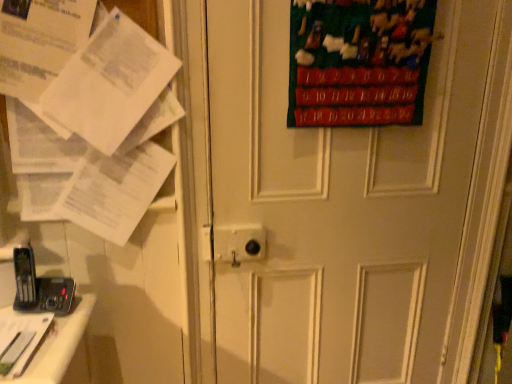
The height and width of the screenshot is (384, 512). What do you see at coordinates (40, 287) in the screenshot?
I see `black plastic phone at lower left` at bounding box center [40, 287].

This screenshot has width=512, height=384. I want to click on white matte door at center, so click(x=348, y=212).

What do you see at coordinates (359, 61) in the screenshot? I see `velvet green poster at upper right` at bounding box center [359, 61].

Locate an element on the screen. black plastic phone at lower left is located at coordinates (40, 287).

Measure the distance from white paper at left to white matte door at center.

white paper at left and white matte door at center are 17.59 inches apart.

The width and height of the screenshot is (512, 384). I want to click on door below the white paper at left (from a real-world perspective), so click(348, 212).

Is white paper at left touching white matte door at center?

No, white paper at left is not next to white matte door at center.

Considering the relative sizes of white paper at left and white matte door at center in the image provided, is white paper at left wider than white matte door at center?

In fact, white paper at left might be narrower than white matte door at center.

From a real-world perspective, is velvet green poster at upper right over white paper at left?

Indeed, from a real-world perspective, velvet green poster at upper right stands above white paper at left.

Is the depth of velvet green poster at upper right greater than that of white paper at left?

That is True.

Which point is more distant from viewer, [407,1] or [78,116]?

The point [407,1] is farther from the camera.

Can you see white matte door at center touching black plastic phone at lower left?

No, white matte door at center is not next to black plastic phone at lower left.

Considering the sizes of objects white matte door at center and black plastic phone at lower left in the image provided, who is thinner, white matte door at center or black plastic phone at lower left?

black plastic phone at lower left is thinner.

Is white matte door at center closer to the viewer compared to black plastic phone at lower left?

Yes, white matte door at center is closer to the viewer.

Is white matte door at center smaller than black plastic phone at lower left?

Actually, white matte door at center might be larger than black plastic phone at lower left.

Would you say white paper at left is a long distance from black plastic phone at lower left?

They are positioned close to each other.

Is white paper at left oriented away from black plastic phone at lower left?

white paper at left does not have its back to black plastic phone at lower left.

Considering the positions of objects white paper at left and black plastic phone at lower left in the image provided, who is more to the left, white paper at left or black plastic phone at lower left?

Positioned to the left is black plastic phone at lower left.

Is white matte door at center facing away from velvet green poster at upper right?

Yes, white matte door at center is facing away from velvet green poster at upper right.

Does white matte door at center lie behind velvet green poster at upper right?

No, white matte door at center is closer to the camera.

Which is in front, point (240, 63) or point (323, 110)?

Point (240, 63)

Is black plastic phone at lower left smaller than white paper at left?

Yes, black plastic phone at lower left is smaller than white paper at left.

From a real-world perspective, is black plastic phone at lower left physically located above or below white paper at left?

In terms of real-world spatial position, black plastic phone at lower left is below white paper at left.

Between point (51, 282) and point (135, 200), which one is positioned behind?

The point (135, 200) is more distant.

From a real-world perspective, is velvet green poster at upper right located beneath black plastic phone at lower left?

Incorrect, from a real-world perspective, velvet green poster at upper right is higher than black plastic phone at lower left.

Is velvet green poster at upper right to the left of black plastic phone at lower left from the viewer's perspective?

In fact, velvet green poster at upper right is to the right of black plastic phone at lower left.

Does point (325, 125) come in front of point (45, 286)?

No, it is not.

Does velvet green poster at upper right contain black plastic phone at lower left?

That's incorrect, black plastic phone at lower left is not inside velvet green poster at upper right.

Where is `door on the right of white paper at left`? This screenshot has width=512, height=384. door on the right of white paper at left is located at coordinates (348, 212).

You are a GUI agent. You are given a task and a screenshot of the screen. Output one action in this format:
    pyautogui.click(x=<x>, y=<y>)
    Task: Click on the paper below the velvet green poster at upper right (from a real-world perspective)
    This screenshot has width=512, height=384.
    Given the screenshot: What is the action you would take?
    pyautogui.click(x=113, y=125)

From the image, which object appears to be farther from black plastic phone at lower left, white paper at left or velvet green poster at upper right?

Based on the image, velvet green poster at upper right appears to be further to black plastic phone at lower left.

Which object lies nearer to the anchor point black plastic phone at lower left, velvet green poster at upper right or white paper at left?

white paper at left is positioned closer to the anchor black plastic phone at lower left.

Based on their spatial positions, is white matte door at center or velvet green poster at upper right closer to white paper at left?

The object closer to white paper at left is white matte door at center.

Based on their spatial positions, is black plastic phone at lower left or velvet green poster at upper right closer to white matte door at center?

Among the two, velvet green poster at upper right is located nearer to white matte door at center.

When comparing their distances from black plastic phone at lower left, does white matte door at center or velvet green poster at upper right seem closer?

white matte door at center is closer to black plastic phone at lower left.

Estimate the real-world distances between objects in this image. Which object is further from white matte door at center, velvet green poster at upper right or white paper at left?

white paper at left.

Considering their positions, is black plastic phone at lower left positioned further to velvet green poster at upper right than white paper at left?

black plastic phone at lower left is further to velvet green poster at upper right.

Looking at this image, estimate the real-world distances between objects in this image. Which object is closer to white paper at left, black plastic phone at lower left or white matte door at center?

black plastic phone at lower left lies closer to white paper at left than the other object.

At what (x,y) coordinates should I click in order to perform the action: click on door between black plastic phone at lower left and velvet green poster at upper right from left to right. Please return your answer as a coordinate pair (x, y). Looking at the image, I should click on (348, 212).

Find the location of a particular element. The width and height of the screenshot is (512, 384). door located between white paper at left and velvet green poster at upper right in the left-right direction is located at coordinates (348, 212).

Find the location of `paper situated between black plastic phone at lower left and velvet green poster at upper right from left to right`. paper situated between black plastic phone at lower left and velvet green poster at upper right from left to right is located at coordinates [113, 125].

This screenshot has width=512, height=384. Find the location of `paper between black plastic phone at lower left and white matte door at center from left to right`. paper between black plastic phone at lower left and white matte door at center from left to right is located at coordinates (113, 125).